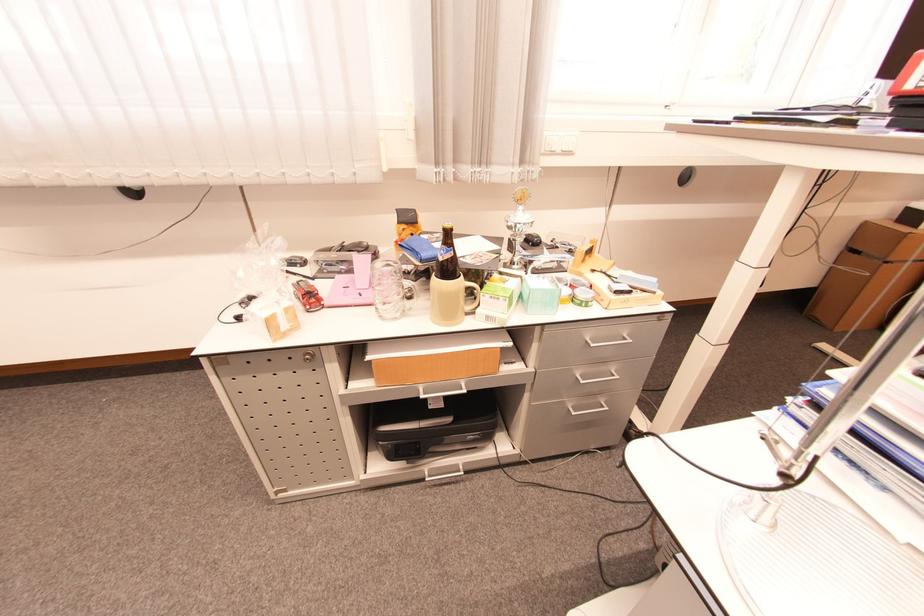
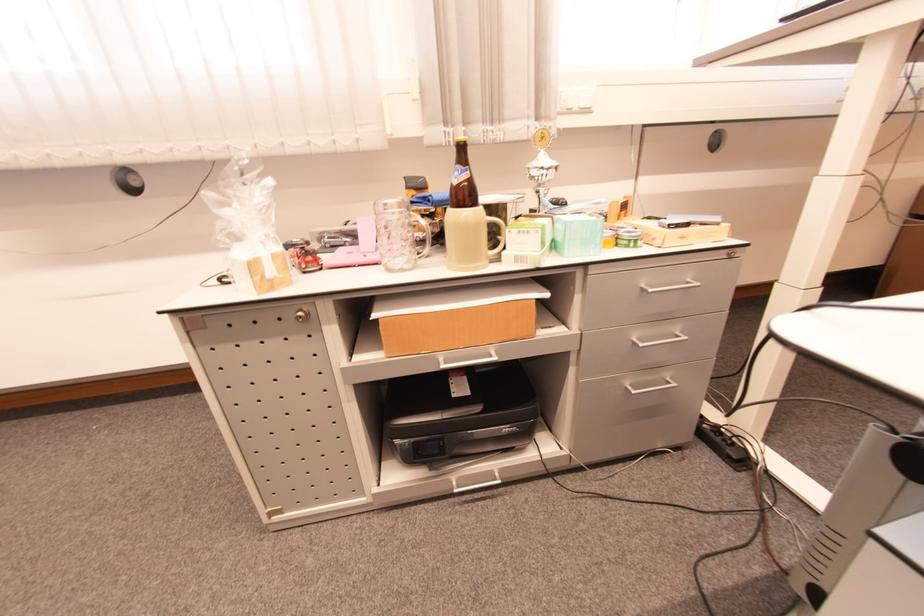
Question: The images are taken continuously from a first-person perspective. In which direction are you moving?

Choices:
 (A) Left
 (B) Right
 (C) Forward
 (D) Backward

Answer: (C)